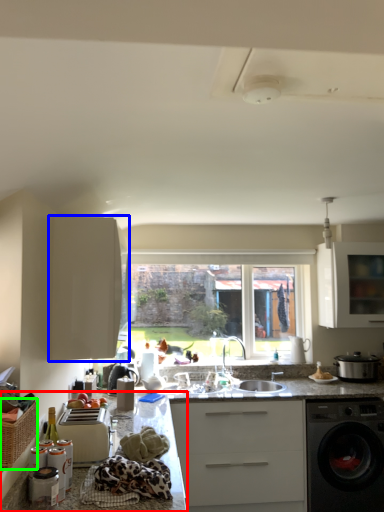
Question: Estimate the real-world distances between objects in this image. Which object is farther from countertop (highlighted by a red box), cabinetry (highlighted by a blue box) or basket (highlighted by a green box)?

Choices:
 (A) cabinetry
 (B) basket

Answer: (B)